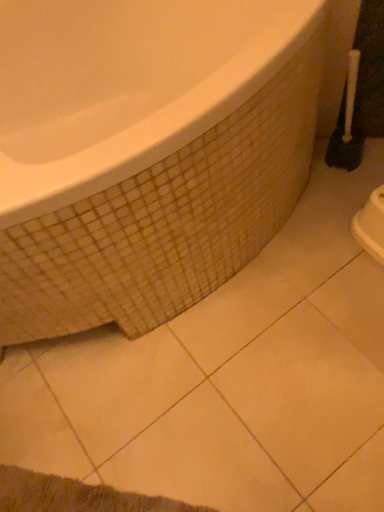
Identify the location of free space in front of white plastic toilet brush at right. Image resolution: width=384 pixels, height=512 pixels. (345, 193).